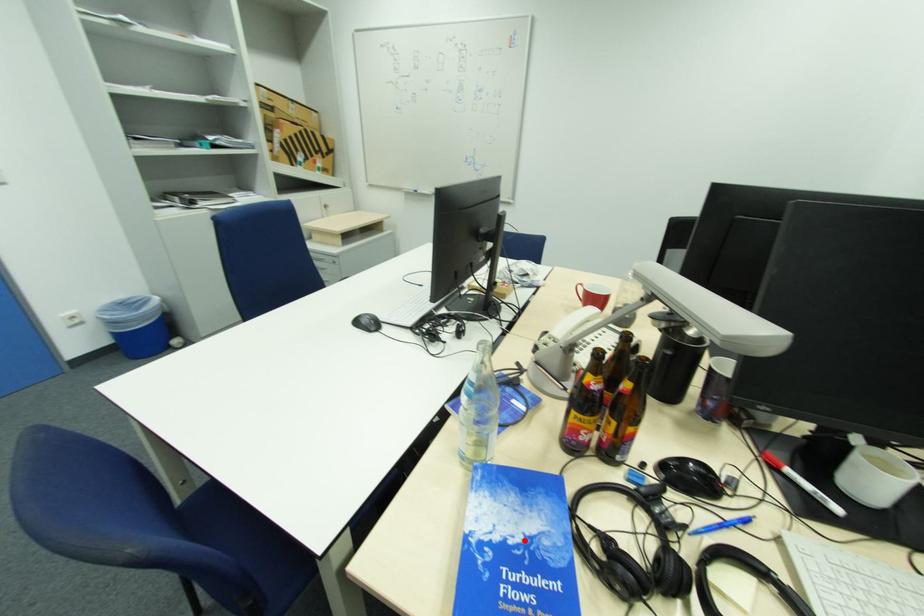
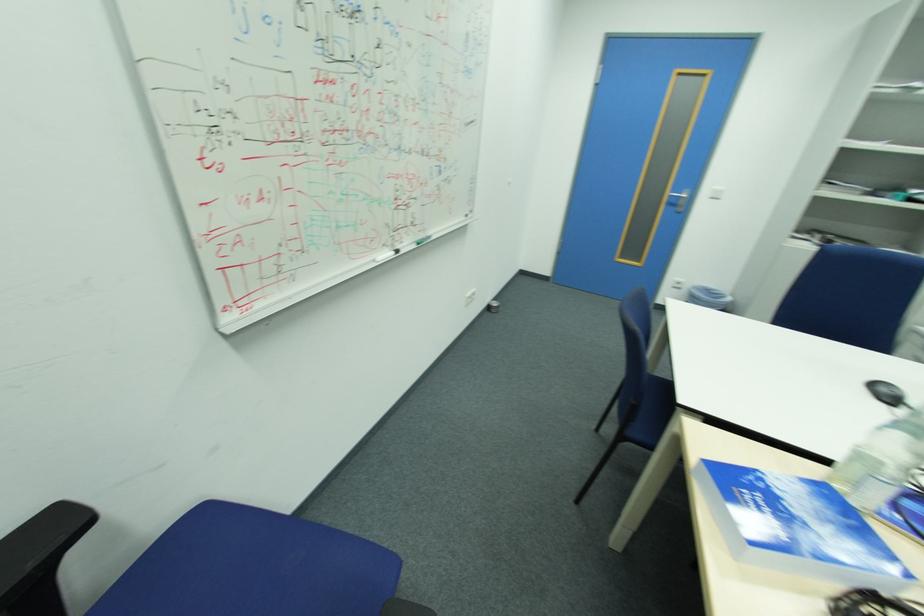
In the second image, find the point that corresponds to the highlighted location in the first image.

(796, 512)